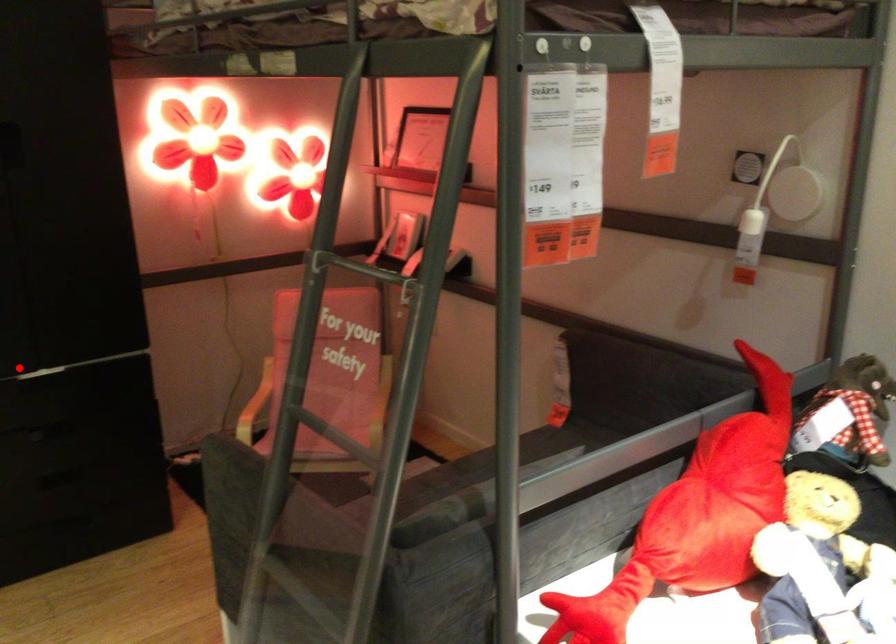
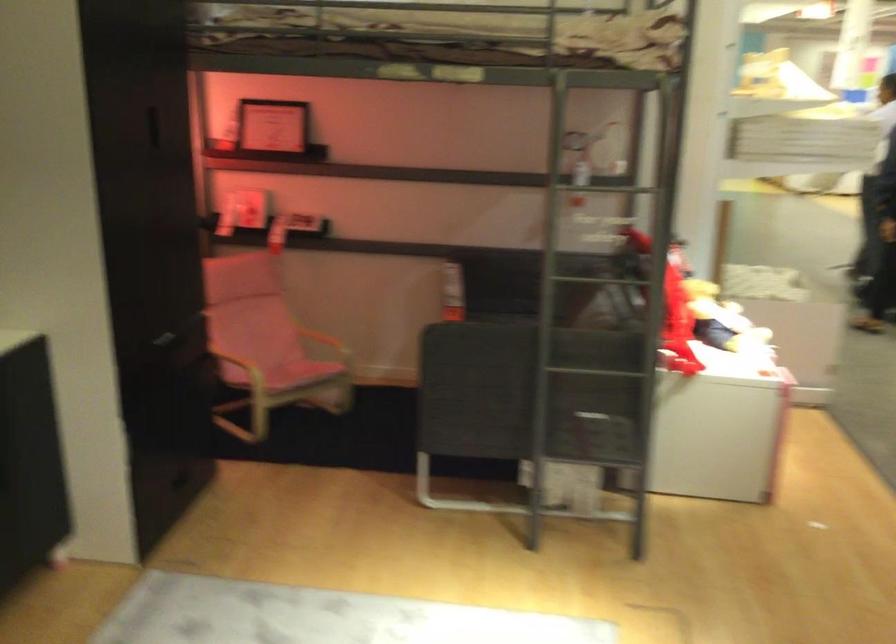
Question: I am providing you with two images of the same scene from different viewpoints. A red point is marked on the first image. Is the red point's position out of view in image 2?

Choices:
 (A) Yes
 (B) No

Answer: (A)